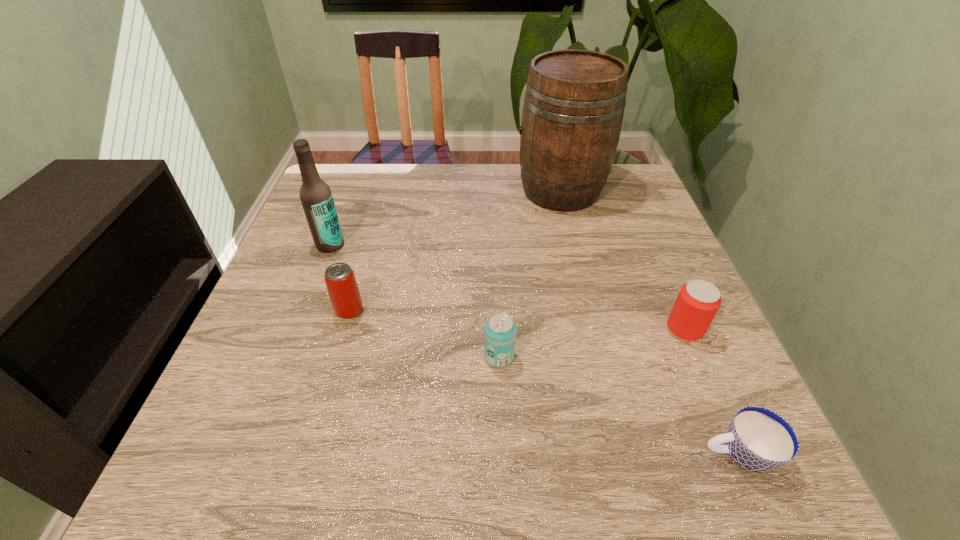
What are the coordinates of `cider` in the screenshot? It's located at (574, 103).

Identify the location of the farthest object. (574, 103).

Find the location of `the leftmost object`. the leftmost object is located at coordinates (316, 198).

This screenshot has height=540, width=960. Identify the location of beer bottle. (316, 198).

Locate an element on the screen. The width and height of the screenshot is (960, 540). the leftmost beer can is located at coordinates (342, 287).

At what (x,y) coordinates should I click in order to perform the action: click on the rightmost beer can. Please return your answer as a coordinate pair (x, y). Looking at the image, I should click on (698, 301).

Locate an element on the screen. This screenshot has width=960, height=540. the nearest beer can is located at coordinates (500, 329).

Find the location of `the fifth farthest object`. the fifth farthest object is located at coordinates pyautogui.click(x=500, y=329).

This screenshot has height=540, width=960. Identify the location of the shortest object. (758, 440).

Identify the location of the nearest object. This screenshot has height=540, width=960. (758, 440).